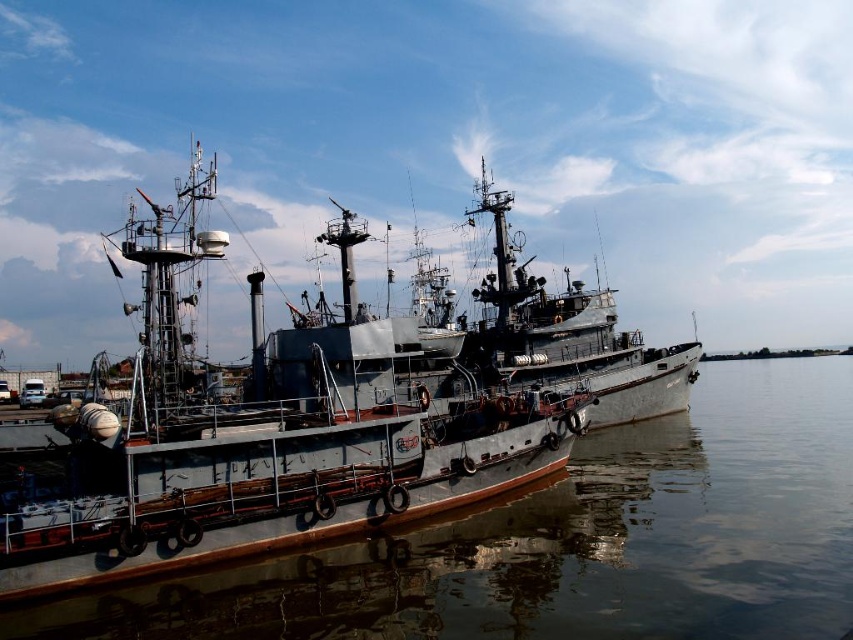
You are standing on the dock and want to board the gray metallic ship at center. The dock is 200 feet long. Can you reach the ship from the dock without needing to swim?

The gray metallic ship at center is 220.56 feet away from the viewer. Since the dock is only 200 feet long, you cannot reach the ship without swimming as the distance exceeds the dock length.

You are standing at the edge of the harbor facing the ships. You notice two points marked in the scene. Which point, point [498,600] or point [183,384], is closer to you?

Point [498,600] is closer to the viewer than point [183,384].

You are a photographer planning to capture the entire rusty metal ship at center and the smooth gray water at center in a single frame. Given that your camera has a fixed focal length, which object should you position closer to the camera to ensure both fit within the frame?

The smooth gray water at center is wider than the rusty metal ship at center. To ensure both fit in the frame, position the camera closer to the rusty metal ship at center so that its narrower width can be captured without cropping, while the wider smooth gray water at center will naturally fit within the frame as well.